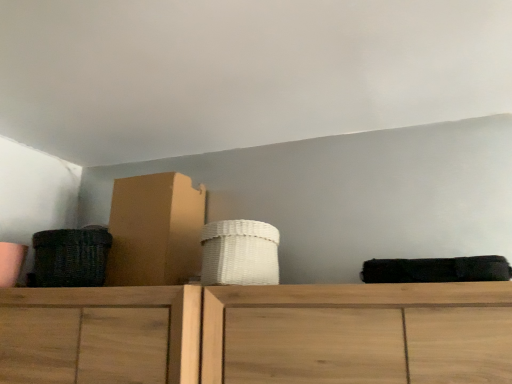
Question: Is dark brown woven basket at left, which is counted as the 1th basket, starting from the left, wider than cardboard box at left?

Choices:
 (A) no
 (B) yes

Answer: (A)

Question: Is dark brown woven basket at left, which is counted as the 1th basket, starting from the left, outside cardboard box at left?

Choices:
 (A) yes
 (B) no

Answer: (A)

Question: From the image's perspective, is dark brown woven basket at left, placed as the second basket when sorted from right to left, on top of cardboard box at left?

Choices:
 (A) yes
 (B) no

Answer: (B)

Question: Does dark brown woven basket at left, which is counted as the 1th basket, starting from the left, turn towards cardboard box at left?

Choices:
 (A) no
 (B) yes

Answer: (A)

Question: Is dark brown woven basket at left, which is counted as the 1th basket, starting from the left, surrounding cardboard box at left?

Choices:
 (A) yes
 (B) no

Answer: (B)

Question: From a real-world perspective, is dark brown woven basket at left, which is counted as the 1th basket, starting from the left, positioned under cardboard box at left based on gravity?

Choices:
 (A) no
 (B) yes

Answer: (B)

Question: From a real-world perspective, is white woven basket at center, which is counted as the 2th basket, starting from the left, on top of cardboard box at left?

Choices:
 (A) yes
 (B) no

Answer: (B)

Question: Does white woven basket at center, which is counted as the 2th basket, starting from the left, have a lesser height compared to cardboard box at left?

Choices:
 (A) yes
 (B) no

Answer: (A)

Question: Is white woven basket at center, positioned as the first basket in right-to-left order, facing towards cardboard box at left?

Choices:
 (A) yes
 (B) no

Answer: (B)

Question: From the image's perspective, is white woven basket at center, positioned as the first basket in right-to-left order, below cardboard box at left?

Choices:
 (A) yes
 (B) no

Answer: (A)

Question: Would you consider white woven basket at center, positioned as the first basket in right-to-left order, to be distant from cardboard box at left?

Choices:
 (A) no
 (B) yes

Answer: (A)

Question: Is white woven basket at center, which is counted as the 2th basket, starting from the left, located outside cardboard box at left?

Choices:
 (A) no
 (B) yes

Answer: (B)

Question: Is white woven basket at center, which is counted as the 2th basket, starting from the left, outside of dark brown woven basket at left, which is counted as the 1th basket, starting from the left?

Choices:
 (A) yes
 (B) no

Answer: (A)